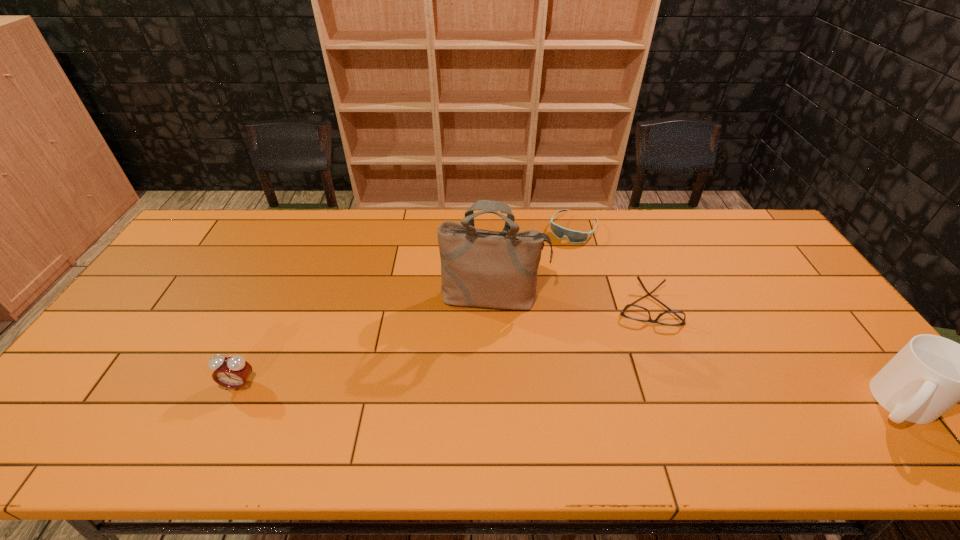
In the image, there is a desktop. Identify the location of blank space at the right edge. (795, 294).

What are the coordinates of `vacant space at the far right corner of the desktop` in the screenshot? It's located at (732, 234).

Find the location of `empty location between the fourth object from right to left and the spectacles`. empty location between the fourth object from right to left and the spectacles is located at coordinates (570, 302).

Where is `empty location between the farthest object and the spectacles`? This screenshot has width=960, height=540. empty location between the farthest object and the spectacles is located at coordinates (610, 267).

The width and height of the screenshot is (960, 540). I want to click on vacant region between the spectacles and the farthest object, so click(610, 267).

Where is `vacant area between the leftmost object and the spectacles`? vacant area between the leftmost object and the spectacles is located at coordinates (444, 346).

You are a GUI agent. You are given a task and a screenshot of the screen. Output one action in this format:
    pyautogui.click(x=<x>, y=<y>)
    Task: Click on the free spot between the goggles and the alarm clock
    
    Given the screenshot: What is the action you would take?
    pyautogui.click(x=406, y=307)

Identify the location of the third closest object to the tallest object. This screenshot has height=540, width=960. (233, 372).

In order to click on object identified as the closest to the second tallest object in this screenshot , I will do `click(635, 312)`.